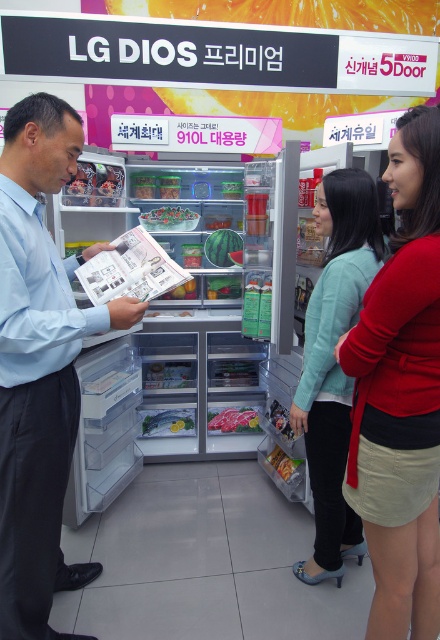
Does light blue shirt at left have a greater height compared to shiny silver fish at center?

Correct, light blue shirt at left is much taller as shiny silver fish at center.

Which is behind, point (52, 632) or point (161, 426)?

The point (161, 426) is more distant.

Where is `light blue shirt at left`? light blue shirt at left is located at coordinates (40, 365).

Can you confirm if red satin blouse at center is wider than light blue sweater at center?

No, red satin blouse at center is not wider than light blue sweater at center.

Can you confirm if red satin blouse at center is thinner than light blue sweater at center?

Correct, red satin blouse at center's width is less than light blue sweater at center's.

Does point (388, 294) come farther from viewer compared to point (322, 355)?

No, it is in front of (322, 355).

Locate an element on the screen. red satin blouse at center is located at coordinates (400, 396).

Describe the element at coordinates (400, 396) in the screenshot. I see `red satin blouse at center` at that location.

At what (x,y) coordinates should I click in order to perform the action: click on red satin blouse at center. Please return your answer as a coordinate pair (x, y). The width and height of the screenshot is (440, 640). Looking at the image, I should click on (x=400, y=396).